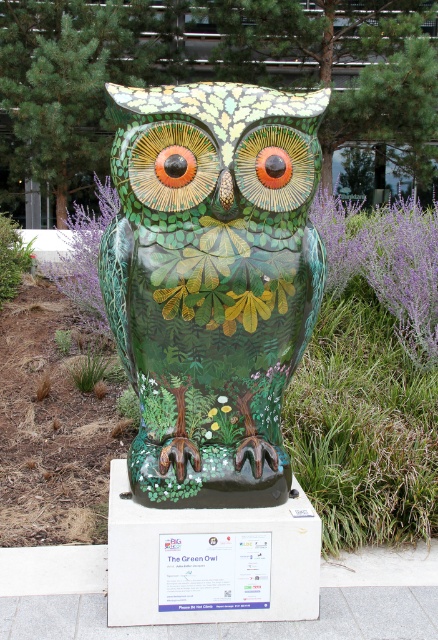
Question: Which point appears closest to the camera in this image?

Choices:
 (A) (219, 426)
 (B) (226, 401)

Answer: (B)

Question: Which object appears closest to the camera in this image?

Choices:
 (A) white fluffy flower at center
 (B) purple fuzzy flower at center
 (C) shiny ceramic owl at center

Answer: (C)

Question: Can you confirm if shiny ceramic owl at center is positioned to the right of green glossy flower at center?

Choices:
 (A) no
 (B) yes

Answer: (A)

Question: Considering the relative positions of purple fuzzy flower at center and green glossy flower at center in the image provided, where is purple fuzzy flower at center located with respect to green glossy flower at center?

Choices:
 (A) below
 (B) above

Answer: (B)

Question: Considering the relative positions of purple fuzzy flower at center and white fluffy flower at center in the image provided, where is purple fuzzy flower at center located with respect to white fluffy flower at center?

Choices:
 (A) right
 (B) left

Answer: (B)

Question: Which object appears closest to the camera in this image?

Choices:
 (A) white fluffy flower at center
 (B) green glossy flower at center
 (C) yellow matte flower at center

Answer: (B)